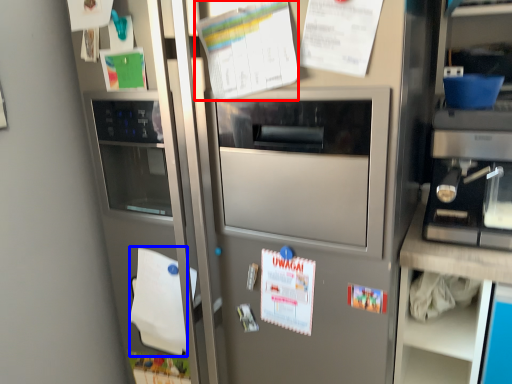
Question: Among these objects, which one is nearest to the camera, poster (highlighted by a red box) or notepad (highlighted by a blue box)?

Choices:
 (A) poster
 (B) notepad

Answer: (A)